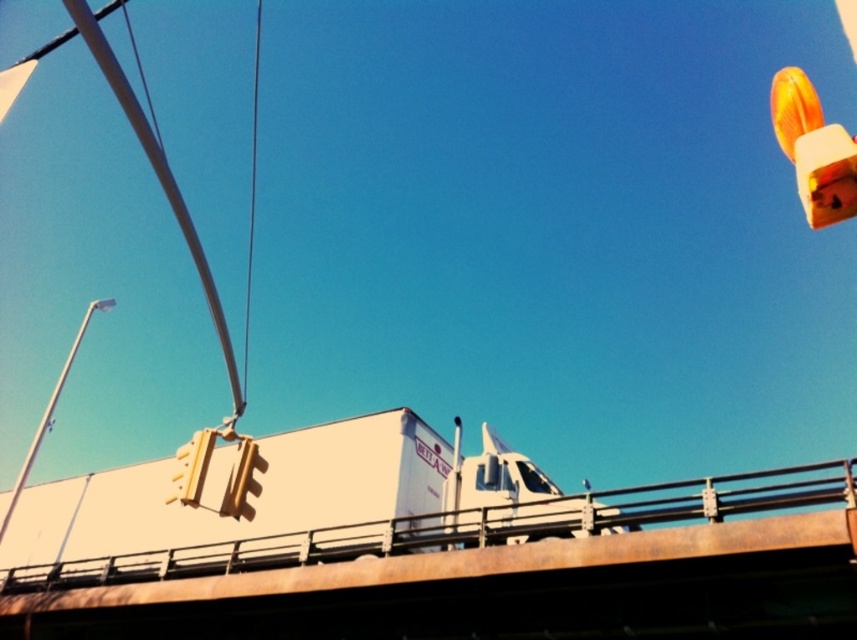
You are standing on the sidewalk and see the white matte truck at center and the white metal pole at left. Which object is closer to the right edge of the image?

The white matte truck at center is positioned on the right side of the white metal pole at left, so it is closer to the right edge of the image.

You are a delivery driver who needs to pass under the orange glossy traffic light at upper right with your white matte truck at center. Can your truck pass under it without hitting the light?

The white matte truck at center is not as tall as orange glossy traffic light at upper right, so the truck can pass under it without hitting the light.

Consider the image. You are standing at the position of point [21,477] and want to reach point [735,612]. Given the scene described, what obstacle might be in your path?

The traffic signal pole extending diagonally across the frame might be in your path as point [735,612] is in front of point [21,477], indicating the pole could block the direct route between them.